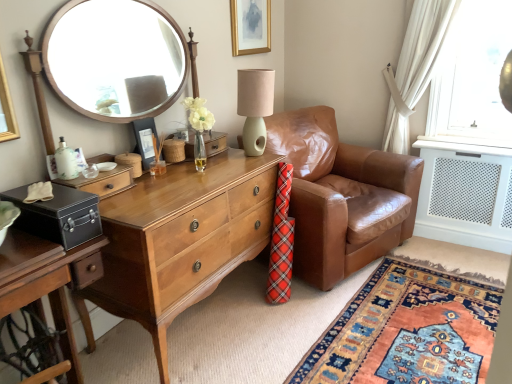
Question: Is black matte picture frame at center, which is the first picture frame from bottom to top, outside of brown leather armchair at center?

Choices:
 (A) yes
 (B) no

Answer: (A)

Question: Is black matte picture frame at center, placed as the 2th picture frame when sorted from right to left, at the right side of brown leather armchair at center?

Choices:
 (A) no
 (B) yes

Answer: (A)

Question: Is black matte picture frame at center, which is the first picture frame from bottom to top, bigger than brown leather armchair at center?

Choices:
 (A) yes
 (B) no

Answer: (B)

Question: Is black matte picture frame at center, which is the first picture frame from bottom to top, in front of brown leather armchair at center?

Choices:
 (A) no
 (B) yes

Answer: (A)

Question: Could you tell me if black matte picture frame at center, arranged as the 1th picture frame when viewed from the front, is facing brown leather armchair at center?

Choices:
 (A) no
 (B) yes

Answer: (A)

Question: In terms of height, does brown leather armchair at center look taller or shorter compared to black matte picture frame at center, which is the first picture frame from bottom to top?

Choices:
 (A) tall
 (B) short

Answer: (A)

Question: From a real-world perspective, is brown leather armchair at center above or below black matte picture frame at center, positioned as the first picture frame in left-to-right order?

Choices:
 (A) above
 (B) below

Answer: (B)

Question: Based on their positions, is brown leather armchair at center located to the left or right of black matte picture frame at center, which is the first picture frame from bottom to top?

Choices:
 (A) left
 (B) right

Answer: (B)

Question: In the image, is brown leather armchair at center positioned in front of or behind black matte picture frame at center, placed as the 2th picture frame when sorted from right to left?

Choices:
 (A) front
 (B) behind

Answer: (A)

Question: From a real-world perspective, is black matte picture frame at center, which is counted as the 2th picture frame, starting from the top, above or below mint green ceramic table lamp at center?

Choices:
 (A) below
 (B) above

Answer: (A)

Question: Based on their positions, is black matte picture frame at center, positioned as the first picture frame in left-to-right order, located to the left or right of mint green ceramic table lamp at center?

Choices:
 (A) left
 (B) right

Answer: (A)

Question: Does point pos(138,140) appear closer or farther from the camera than point pos(261,129)?

Choices:
 (A) farther
 (B) closer

Answer: (B)

Question: From the image's perspective, is black matte picture frame at center, which is the first picture frame from bottom to top, above or below mint green ceramic table lamp at center?

Choices:
 (A) below
 (B) above

Answer: (A)

Question: From the image's perspective, is matte black safe at left located above or below light brown wood desk at center?

Choices:
 (A) below
 (B) above

Answer: (A)

Question: Would you say matte black safe at left is inside or outside light brown wood desk at center?

Choices:
 (A) outside
 (B) inside

Answer: (A)